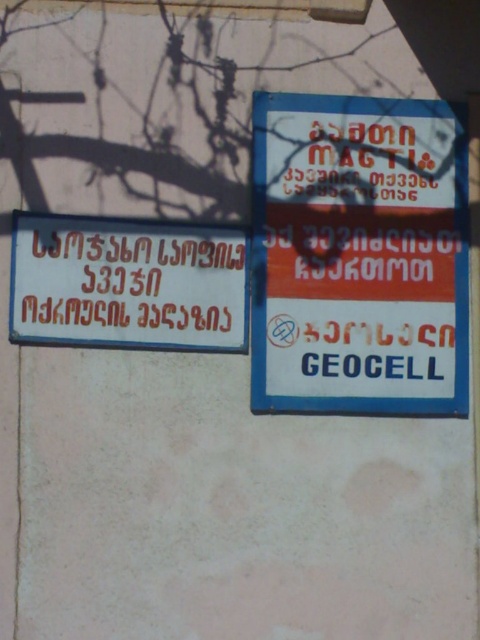
You are a contractor measuring the distance between two signs on a wall. The blue plastic sign at upper right and the matte red sign at center are both important for your project. According to your measurements, how far apart are these two signs?

The blue plastic sign at upper right is 12.79 inches from the matte red sign at center, so the distance between them is 12.79 inches.

You are a construction worker who needs to locate the GEOCELL materials. You see a blue plastic sign at upper right and a matte red sign at center. Which sign is closer to the right edge of the wall?

The blue plastic sign at upper right is positioned on the right side of the matte red sign at center, so it is closer to the right edge of the wall.